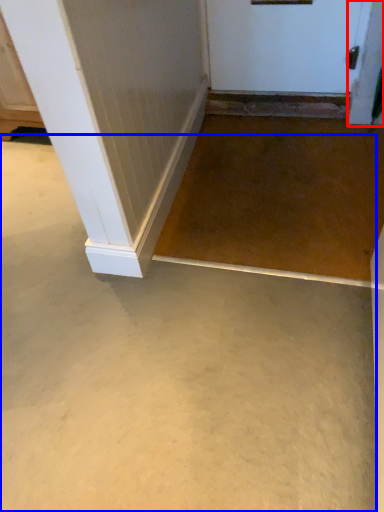
Question: Which object appears closest to the camera in this image, screen door (highlighted by a red box) or concrete (highlighted by a blue box)?

Choices:
 (A) screen door
 (B) concrete

Answer: (B)